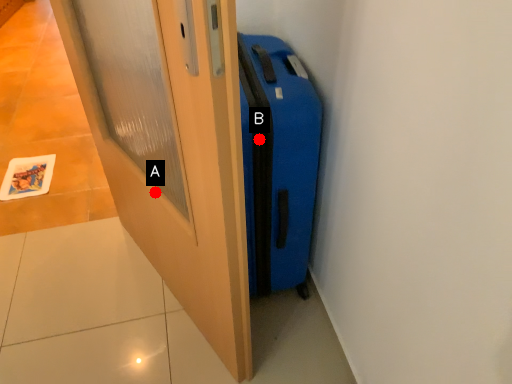
Question: Two points are circled on the image, labeled by A and B beside each circle. Which point is further to the camera?

Choices:
 (A) A is further
 (B) B is further

Answer: (A)